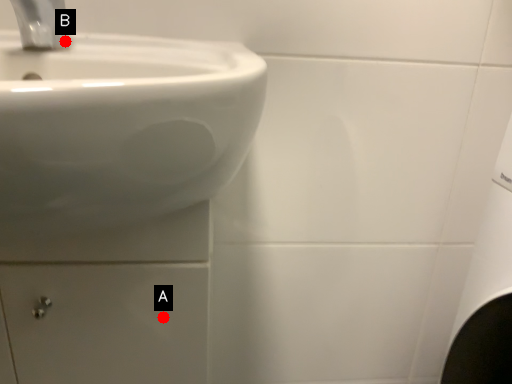
Question: Two points are circled on the image, labeled by A and B beside each circle. Which point appears farthest from the camera in this image?

Choices:
 (A) A is further
 (B) B is further

Answer: (B)